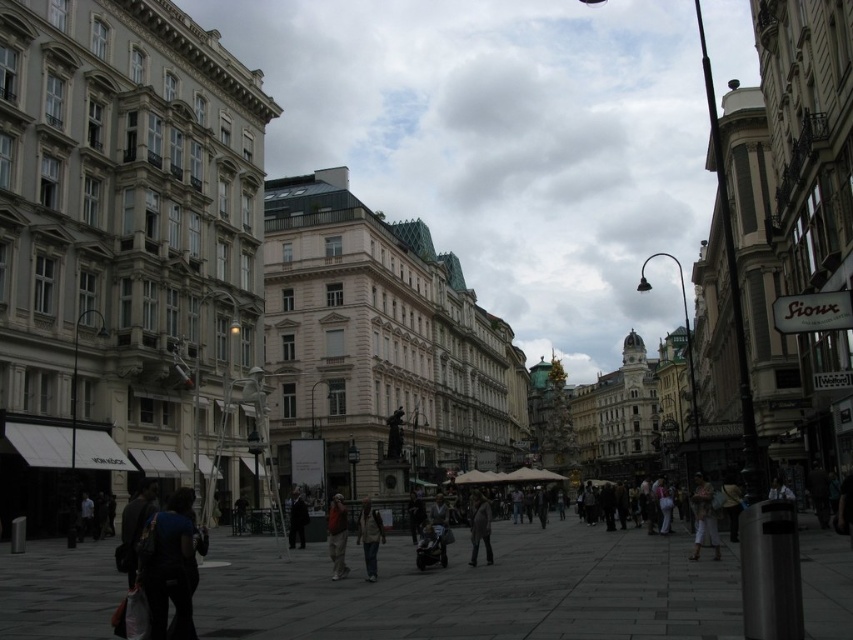
Question: Can you confirm if orange fabric pants at center is wider than dark gray suit at center?

Choices:
 (A) no
 (B) yes

Answer: (B)

Question: Which object appears farthest from the camera in this image?

Choices:
 (A) brown textured coat at center
 (B) dark gray suit at center
 (C) orange fabric pants at center

Answer: (B)

Question: Which point is closer to the camera taking this photo?

Choices:
 (A) (701, 520)
 (B) (347, 572)
 (C) (288, 544)

Answer: (B)

Question: Which object is closer to the camera taking this photo?

Choices:
 (A) orange fabric pants at center
 (B) dark gray suit at center
 (C) dark blue fabric at lower left

Answer: (C)

Question: Is light pink fabric pants at lower right positioned in front of dark gray suit at center?

Choices:
 (A) no
 (B) yes

Answer: (B)

Question: Does orange fabric pants at center appear under brown textured coat at center?

Choices:
 (A) yes
 (B) no

Answer: (A)